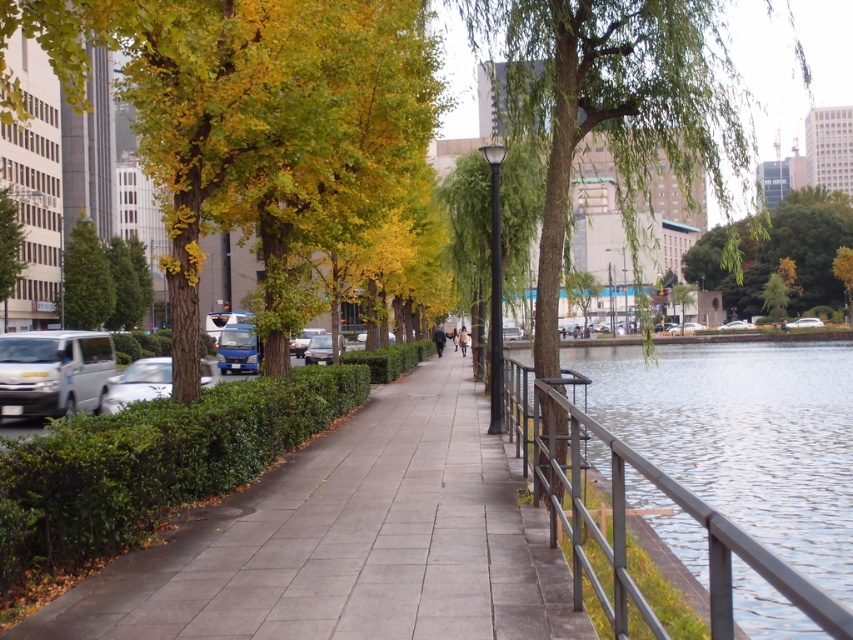
Question: Based on their relative distances, which object is farther from the green leafy tree at upper center?

Choices:
 (A) yellow-green leaves at left
 (B) gray concrete pavement at center
 (C) silver metallic car at left

Answer: (C)

Question: Does gray concrete pavement at center appear under silver metallic car at left?

Choices:
 (A) yes
 (B) no

Answer: (A)

Question: From the image, what is the correct spatial relationship of gray concrete pavement at center in relation to white matte van at left?

Choices:
 (A) right
 (B) left

Answer: (A)

Question: Which point is closer to the camera taking this photo?

Choices:
 (A) [x=311, y=340]
 (B) [x=157, y=381]
 (C) [x=833, y=259]

Answer: (B)

Question: Observing the image, what is the correct spatial positioning of metallic gray railing at center-right in reference to matte silver sedan at center?

Choices:
 (A) above
 (B) below

Answer: (B)

Question: Which of these objects is positioned closest to the metallic gray railing at center-right?

Choices:
 (A) gray concrete pavement at center
 (B) green leafy tree at center
 (C) silver metallic car at left
 (D) green leafy tree at upper center

Answer: (A)